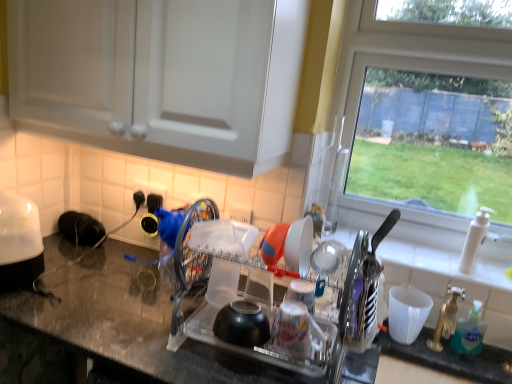
Question: From the image's perspective, does white glossy toaster at left appear lower than white plastic faucet at right?

Choices:
 (A) yes
 (B) no

Answer: (B)

Question: Considering the relative sizes of white glossy toaster at left and white plastic faucet at right in the image provided, is white glossy toaster at left taller than white plastic faucet at right?

Choices:
 (A) no
 (B) yes

Answer: (B)

Question: From the image's perspective, is white glossy toaster at left over white plastic faucet at right?

Choices:
 (A) yes
 (B) no

Answer: (A)

Question: Considering the relative sizes of white glossy toaster at left and white plastic faucet at right in the image provided, is white glossy toaster at left wider than white plastic faucet at right?

Choices:
 (A) yes
 (B) no

Answer: (A)

Question: Considering the relative positions of white glossy toaster at left and white plastic faucet at right in the image provided, is white glossy toaster at left to the right of white plastic faucet at right from the viewer's perspective?

Choices:
 (A) yes
 (B) no

Answer: (B)

Question: Is white glossy toaster at left positioned behind white plastic faucet at right?

Choices:
 (A) yes
 (B) no

Answer: (B)

Question: Does white plastic cup at right, which is counted as the 2th tableware, starting from the left, turn towards white glossy toaster at left?

Choices:
 (A) yes
 (B) no

Answer: (B)

Question: From a real-world perspective, is white plastic cup at right, which is the second tableware in top-to-bottom order, below white glossy toaster at left?

Choices:
 (A) yes
 (B) no

Answer: (A)

Question: Is white plastic cup at right, which appears as the second tableware when viewed from the front, not close to white glossy toaster at left?

Choices:
 (A) no
 (B) yes

Answer: (B)

Question: Is white plastic cup at right, which is the second tableware in top-to-bottom order, in front of white glossy toaster at left?

Choices:
 (A) yes
 (B) no

Answer: (B)

Question: Considering the relative positions of white plastic cup at right, which is the second tableware in top-to-bottom order, and white glossy toaster at left in the image provided, is white plastic cup at right, which is the second tableware in top-to-bottom order, to the right of white glossy toaster at left from the viewer's perspective?

Choices:
 (A) no
 (B) yes

Answer: (B)

Question: From a real-world perspective, is white plastic cup at right, which is the 1th tableware in right-to-left order, physically above white glossy toaster at left?

Choices:
 (A) yes
 (B) no

Answer: (B)

Question: Is white plastic cup at right, which appears as the second tableware when viewed from the front, wider than blue translucent soap dispenser at right?

Choices:
 (A) yes
 (B) no

Answer: (A)